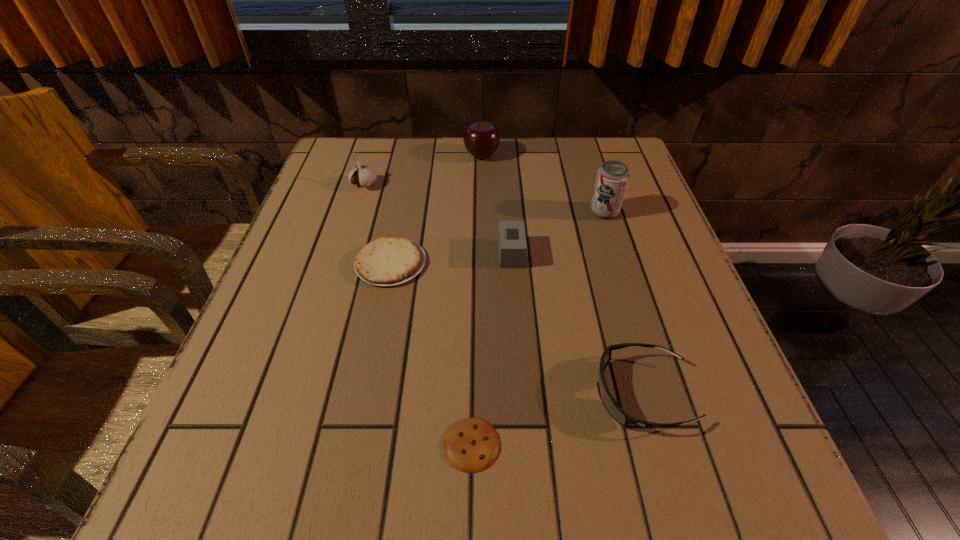
Locate an element on the screen. vacant space positioned on the left of the third farthest object is located at coordinates (547, 212).

Locate an element on the screen. The height and width of the screenshot is (540, 960). vacant position located on the front of the sixth shortest object is located at coordinates click(x=482, y=227).

At what (x,y) coordinates should I click in order to perform the action: click on free space located 0.270m on the front of the garlic. Please return your answer as a coordinate pair (x, y). The image size is (960, 540). Looking at the image, I should click on (338, 269).

Identify the location of vacant area located 0.110m on the front-facing side of the alarm clock. (447, 254).

Identify the location of free space located 0.150m on the front-facing side of the alarm clock. The image size is (960, 540). (429, 254).

The width and height of the screenshot is (960, 540). I want to click on vacant space located 0.290m on the front-facing side of the alarm clock, so click(x=364, y=254).

Where is `free point located 0.290m on the lenses of the goggles`? The image size is (960, 540). free point located 0.290m on the lenses of the goggles is located at coordinates (415, 393).

Where is `vacant space located 0.090m on the lenses of the goggles`? vacant space located 0.090m on the lenses of the goggles is located at coordinates (539, 393).

Locate an element on the screen. vacant area situated on the lenses of the goggles is located at coordinates (514, 393).

Find the location of a particular element. The height and width of the screenshot is (540, 960). vacant space situated 0.170m on the back of the sixth tallest object is located at coordinates (404, 194).